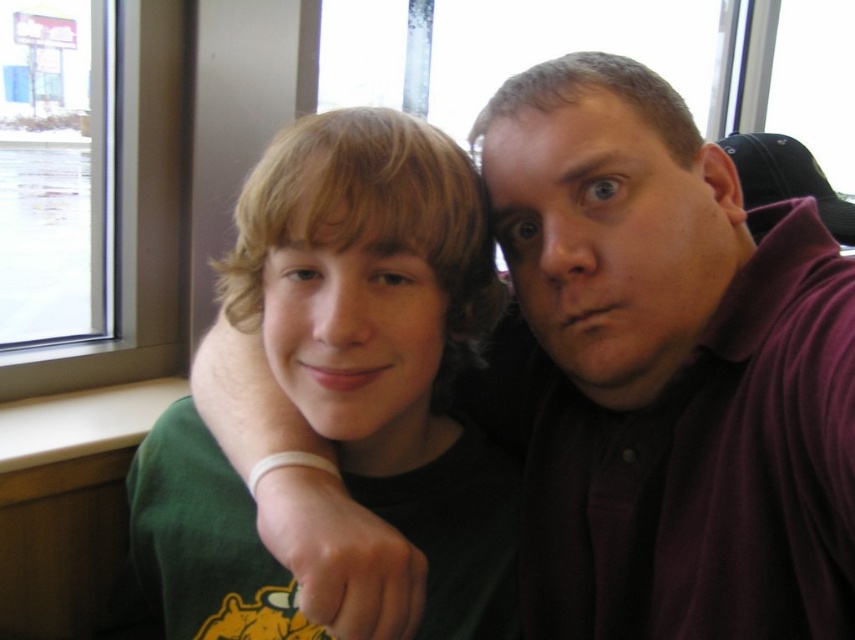
Question: Among these points, which one is nearest to the camera?

Choices:
 (A) (394, 500)
 (B) (93, 19)

Answer: (A)

Question: Does green matte shirt at center have a lesser width compared to transparent glass window at upper left?

Choices:
 (A) yes
 (B) no

Answer: (B)

Question: Does green matte shirt at center have a smaller size compared to transparent glass window at upper left?

Choices:
 (A) yes
 (B) no

Answer: (B)

Question: Considering the relative positions of green matte shirt at center and transparent glass window at upper left in the image provided, where is green matte shirt at center located with respect to transparent glass window at upper left?

Choices:
 (A) above
 (B) below

Answer: (B)